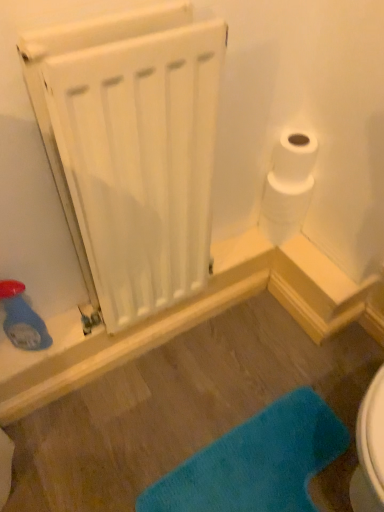
Identify the location of unoccupied space behind blue fuzzy bath mat at lower center. (239, 368).